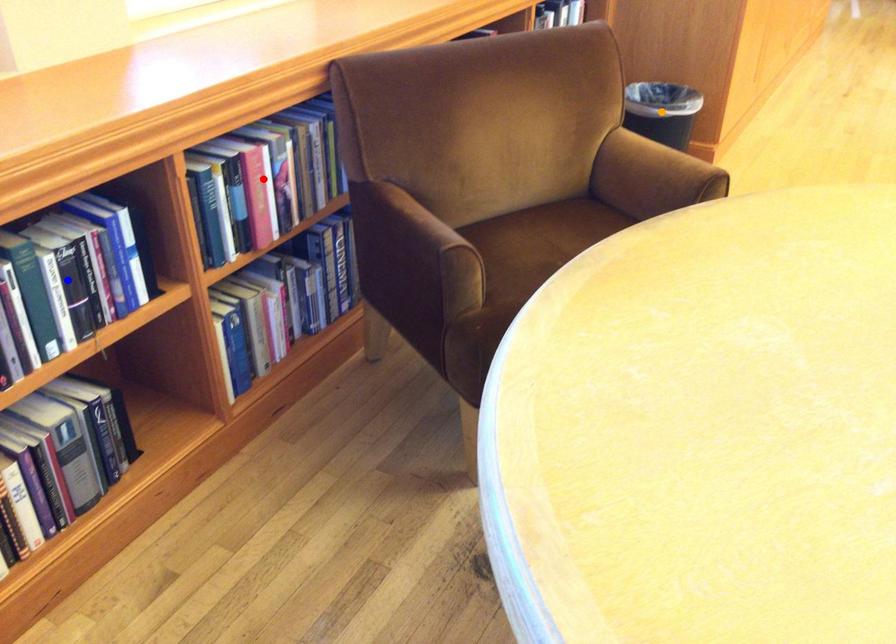
Order these from nearest to farthest:
- blue point
- orange point
- red point

blue point, red point, orange point